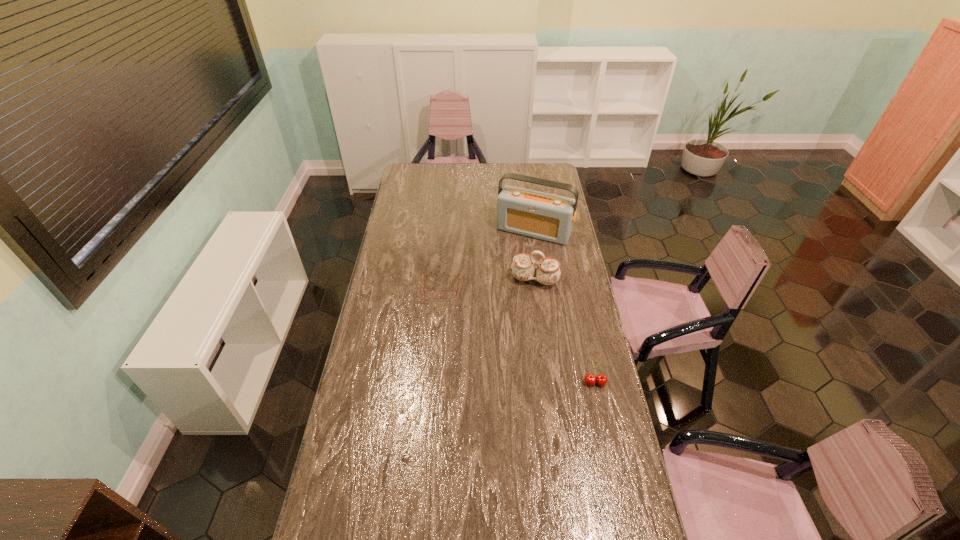
Identify the location of vacant space located 0.190m by the handle of the third shortest object. (523, 322).

In order to click on free space located by the handle of the third shortest object in this screenshot , I will do `click(526, 308)`.

You are a GUI agent. You are given a task and a screenshot of the screen. Output one action in this format:
    pyautogui.click(x=<x>, y=<y>)
    Task: Click on the vacant region located 0.070m on the front-facing side of the farthest object
    Image resolution: width=960 pixels, height=540 pixels.
    Given the screenshot: What is the action you would take?
    click(x=517, y=254)

Locate an element on the screen. The image size is (960, 540). vacant area situated 0.400m on the front-facing side of the farthest object is located at coordinates (494, 300).

Where is `free space located on the front-facing side of the farthest object`? free space located on the front-facing side of the farthest object is located at coordinates (505, 278).

The width and height of the screenshot is (960, 540). Find the location of `cherry that is positioned at the right edge`. cherry that is positioned at the right edge is located at coordinates (601, 379).

What are the coordinates of `chinaware that is at the right edge` in the screenshot? It's located at (548, 272).

Where is `radio receiver located in the right edge section of the desktop`? The image size is (960, 540). radio receiver located in the right edge section of the desktop is located at coordinates (544, 216).

This screenshot has width=960, height=540. What are the coordinates of `vacant region at the far edge` in the screenshot? It's located at (470, 170).

Locate an element on the screen. free space at the left edge is located at coordinates (392, 215).